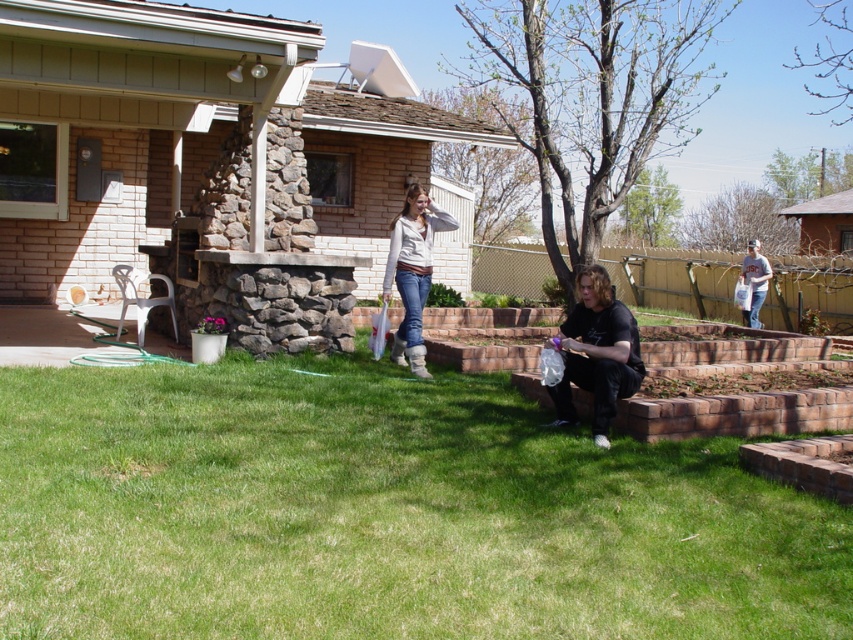
Does green grass at lower center have a greater width compared to black matte shirt at center?

Correct, the width of green grass at lower center exceeds that of black matte shirt at center.

The width and height of the screenshot is (853, 640). Describe the element at coordinates (383, 513) in the screenshot. I see `green grass at lower center` at that location.

Identify the location of green grass at lower center. The height and width of the screenshot is (640, 853). (383, 513).

Is black matte shirt at center further to camera compared to gray cotton t-shirt at right?

No.

Can you confirm if black matte shirt at center is positioned to the left of gray cotton t-shirt at right?

Correct, you'll find black matte shirt at center to the left of gray cotton t-shirt at right.

Is point (590, 337) positioned in front of point (757, 296)?

Yes, it is in front of point (757, 296).

You are a GUI agent. You are given a task and a screenshot of the screen. Output one action in this format:
    pyautogui.click(x=<x>, y=<y>)
    Task: Click on the black matte shirt at center
    
    Given the screenshot: What is the action you would take?
    pyautogui.click(x=596, y=353)

What do you see at coordinates (383, 513) in the screenshot? I see `green grass at lower center` at bounding box center [383, 513].

Is point (776, 545) positioned in front of point (744, 280)?

Yes, it is.

The image size is (853, 640). What are the coordinates of `green grass at lower center` in the screenshot? It's located at (383, 513).